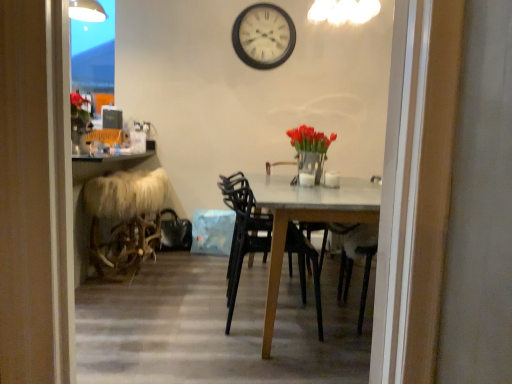
Question: Considering the positions of white matte wall clock at upper center and transparent glass door at upper left in the image, is white matte wall clock at upper center taller or shorter than transparent glass door at upper left?

Choices:
 (A) tall
 (B) short

Answer: (B)

Question: Based on their positions, is white matte wall clock at upper center located to the left or right of transparent glass door at upper left?

Choices:
 (A) right
 (B) left

Answer: (A)

Question: Which of these objects is positioned closest to the white matte wall clock at upper center?

Choices:
 (A) transparent glass door at upper left
 (B) black plastic chair at center
 (C) matte silver vase with red tulips at center
 (D) furry white folding chair at left

Answer: (C)

Question: Which is nearer to the matte silver vase with red tulips at center?

Choices:
 (A) white matte wall clock at upper center
 (B) furry white folding chair at left
 (C) transparent glass door at upper left
 (D) black plastic chair at center

Answer: (D)